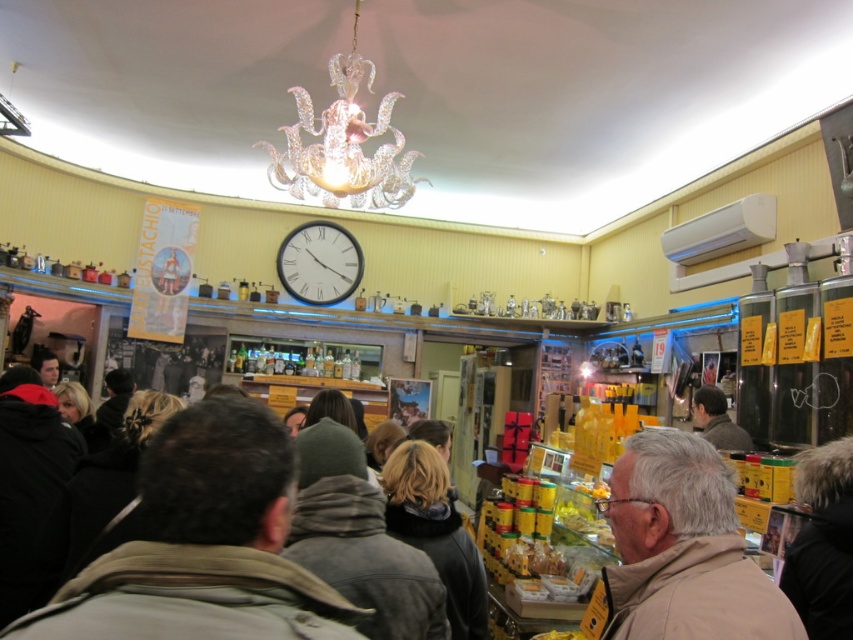
You are standing in the deli and want to reach both the point at coordinates (718, 465) and the point at coordinates (404, 506). Which point should you approach first to minimize walking distance?

You should approach point (718, 465) first because it is closer to you than point (404, 506).

You are a customer in the store and want to place both the brown fuzzy jacket at center and the dark brown leather jacket at center on a shelf that is 1.2 meters wide. Can both jackets fit side by side on the shelf?

The brown fuzzy jacket at center is wider than the dark brown leather jacket at center. If both jackets are placed side by side, their combined width must be less than or equal to 1.2 meters. However, without knowing the exact widths of each jacket, it is impossible to determine if they will fit. Please measure the jackets or check their dimensions for accuracy.

You are a customer in the store and want to know which clothing item is taller between the dark gray jacket at center and the fuzzy black coat at lower right. Can you tell me which one is taller?

The fuzzy black coat at lower right is taller than the dark gray jacket at center.